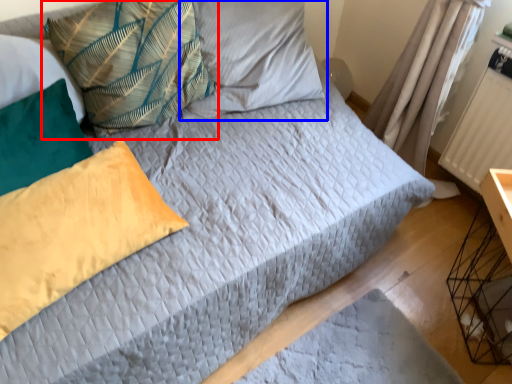
Question: Which object appears farthest to the camera in this image, pillow (highlighted by a red box) or pillow (highlighted by a blue box)?

Choices:
 (A) pillow
 (B) pillow

Answer: (B)